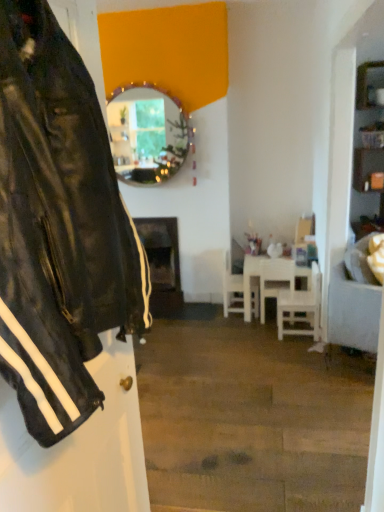
Question: Is white fabric couch at right at the back of wooden-framed mirror at upper center?

Choices:
 (A) no
 (B) yes

Answer: (A)

Question: Is wooden-framed mirror at upper center positioned beyond the bounds of white fabric couch at right?

Choices:
 (A) no
 (B) yes

Answer: (B)

Question: Considering the relative sizes of wooden-framed mirror at upper center and white fabric couch at right in the image provided, is wooden-framed mirror at upper center smaller than white fabric couch at right?

Choices:
 (A) yes
 (B) no

Answer: (A)

Question: Does wooden-framed mirror at upper center appear on the left side of white fabric couch at right?

Choices:
 (A) yes
 (B) no

Answer: (A)

Question: Can you confirm if wooden-framed mirror at upper center is taller than white fabric couch at right?

Choices:
 (A) no
 (B) yes

Answer: (B)

Question: Does point (163, 268) appear closer or farther from the camera than point (117, 91)?

Choices:
 (A) farther
 (B) closer

Answer: (A)

Question: Considering the positions of black matte fireplace at center and wooden-framed mirror at upper center in the image, is black matte fireplace at center wider or thinner than wooden-framed mirror at upper center?

Choices:
 (A) wide
 (B) thin

Answer: (A)

Question: Do you think black matte fireplace at center is within wooden-framed mirror at upper center, or outside of it?

Choices:
 (A) outside
 (B) inside

Answer: (A)

Question: From the image's perspective, is black matte fireplace at center above or below wooden-framed mirror at upper center?

Choices:
 (A) above
 (B) below

Answer: (B)

Question: Based on their positions, is black leather jacket at left located to the left or right of black matte fireplace at center?

Choices:
 (A) right
 (B) left

Answer: (A)

Question: In terms of width, does black leather jacket at left look wider or thinner when compared to black matte fireplace at center?

Choices:
 (A) thin
 (B) wide

Answer: (A)

Question: Considering the positions of black leather jacket at left and black matte fireplace at center in the image, is black leather jacket at left taller or shorter than black matte fireplace at center?

Choices:
 (A) tall
 (B) short

Answer: (A)

Question: From the image's perspective, is black leather jacket at left located above or below black matte fireplace at center?

Choices:
 (A) below
 (B) above

Answer: (A)

Question: Relative to white matte table at center, is wooden shelves at right in front or behind?

Choices:
 (A) behind
 (B) front

Answer: (B)

Question: Does point pos(367,136) appear closer or farther from the camera than point pos(264,295)?

Choices:
 (A) farther
 (B) closer

Answer: (A)